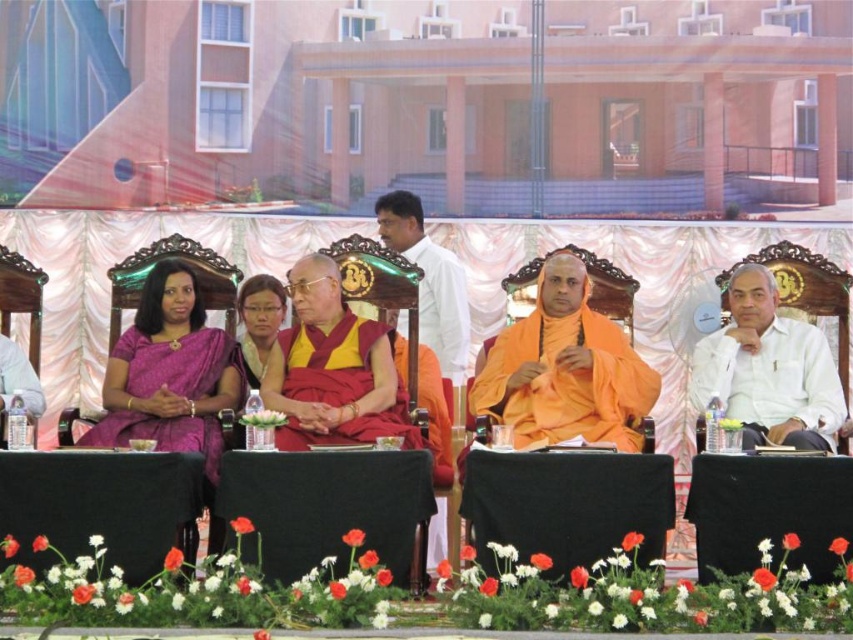
You are organizing a photo shoot for a fashion magazine and need to position two models wearing the yellow silk robe at center and the white silk robe at center. Based on the scene described, which robe should be placed closer to the camera to maintain the original composition?

The yellow silk robe at center should be placed closer to the camera since it is in front of the white silk robe at center in the original scene.

From the picture: You are organizing a photo shoot and need to arrange two outfits for a fashion show. The orange silk robe at center and the white cotton shirt at right are both part of the collection. Which outfit should you choose if you want to display a smaller garment?

The orange silk robe at center has a smaller size compared to the white cotton shirt at right, so you should choose the orange silk robe at center for displaying a smaller garment.